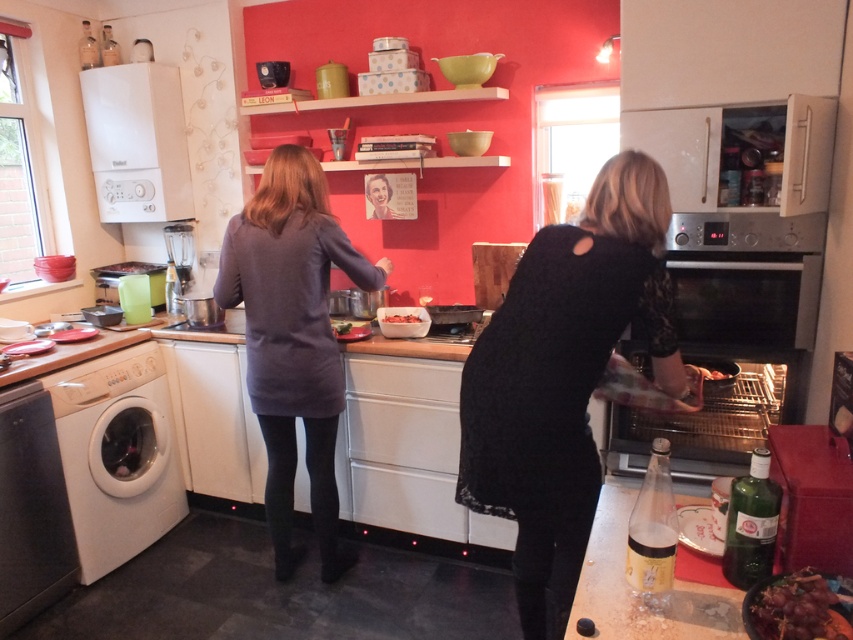
In the kitchen scene with red walls and white cabinetry, there is a washing machine on the left and a dark gray sweater at center. What object is located at the coordinates point (x=293, y=339)?

The point (x=293, y=339) corresponds to the dark gray sweater at center.

You are a fashion designer looking to arrange two garments in a photo shoot setup in the described kitchen. The garments are the black lace dress at center and the dark gray sweater at center. Based on the scene, where should you place each garment to match their positions in the image?

The black lace dress at center should be placed below the dark gray sweater at center to match their positions in the image.